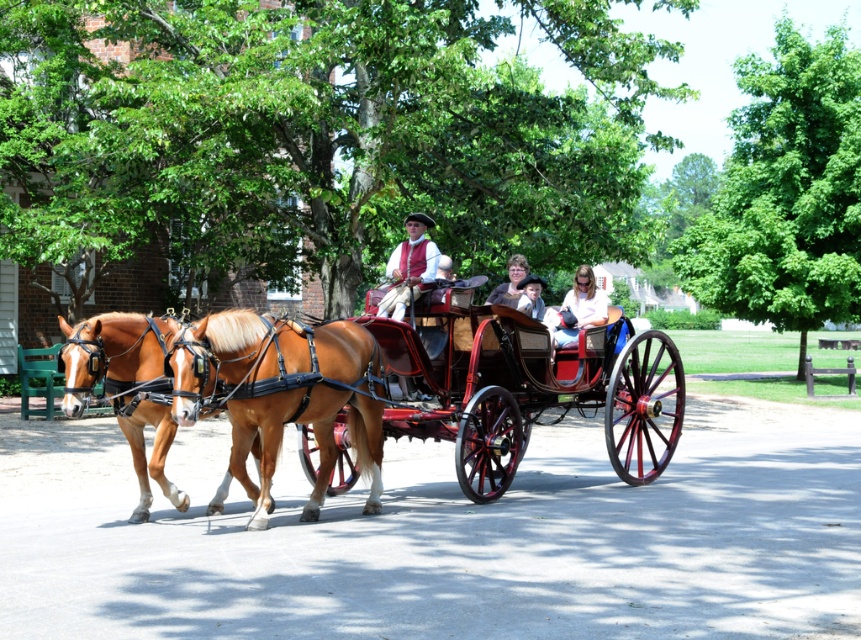
Which is behind, point (395, 257) or point (533, 301)?

Positioned behind is point (533, 301).

Does matte red vest at center appear on the left side of smooth brown hair at center?

Indeed, matte red vest at center is positioned on the left side of smooth brown hair at center.

Does point (394, 301) come behind point (534, 296)?

No, (394, 301) is closer to viewer.

Locate an element on the screen. Image resolution: width=861 pixels, height=640 pixels. matte red vest at center is located at coordinates (409, 268).

Which is more to the left, brown glossy horse at left or smooth brown hair at center?

brown glossy horse at left is more to the left.

At what (x,y) coordinates should I click in order to perform the action: click on brown glossy horse at left. Please return your answer as a coordinate pair (x, y). Looking at the image, I should click on (127, 388).

Who is more forward, (624,456) or (407,301)?

Point (407,301) is more forward.

Which is behind, point (289, 419) or point (406, 250)?

Positioned behind is point (406, 250).

Locate an element on the screen. The height and width of the screenshot is (640, 861). shiny polished wood horse cart at center is located at coordinates (x=525, y=387).